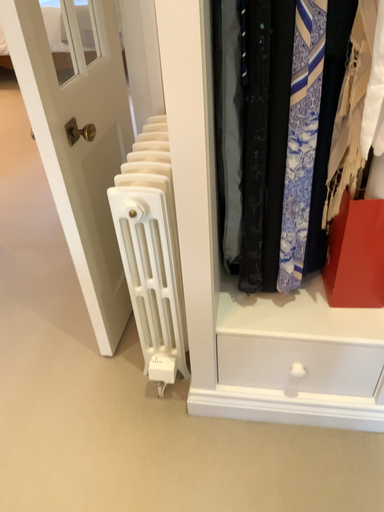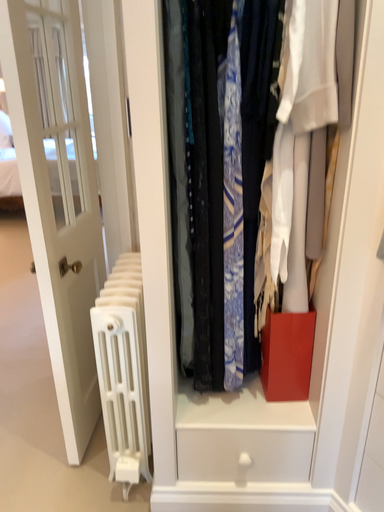
Question: Which way did the camera rotate in the video?

Choices:
 (A) rotated downward
 (B) rotated upward

Answer: (B)